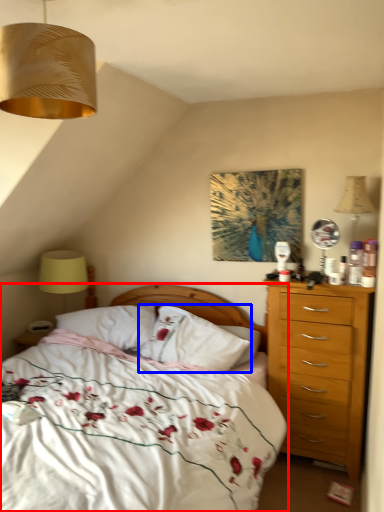
Question: Which object appears farthest to the camera in this image, bed (highlighted by a red box) or pillow (highlighted by a blue box)?

Choices:
 (A) bed
 (B) pillow

Answer: (B)